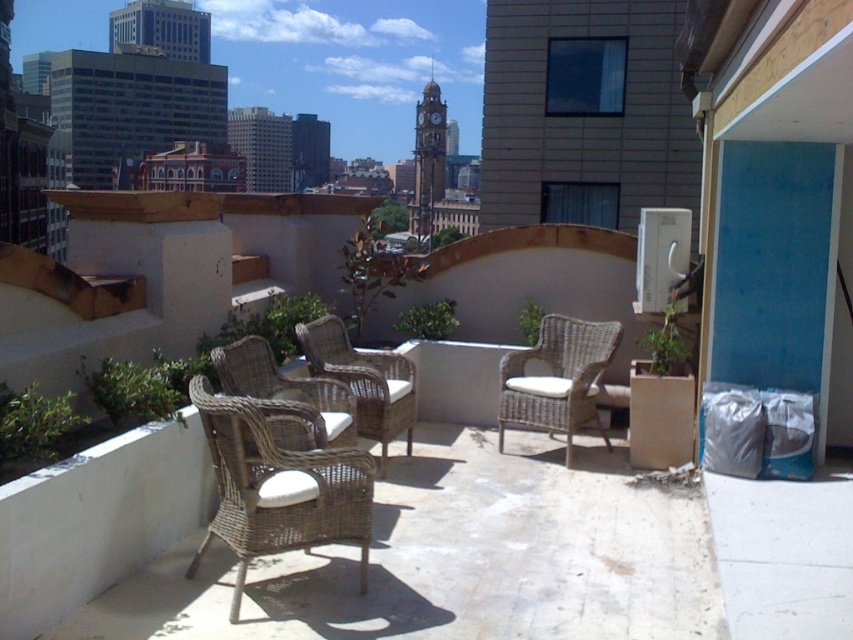
You are planning to place a 1.2 meter wide sofa in the center of the rooftop terrace. Given the presence of the woven rattan chair at center and the woven wicker chair at center, which chair would you need to move to accommodate the sofa?

The woven rattan chair at center has a larger width than the woven wicker chair at center, so you would need to move the woven rattan chair at center to make space for the sofa.

What are the coordinates of the woven rattan chair at center?

The coordinates of the woven rattan chair at center are at point (556, 378).